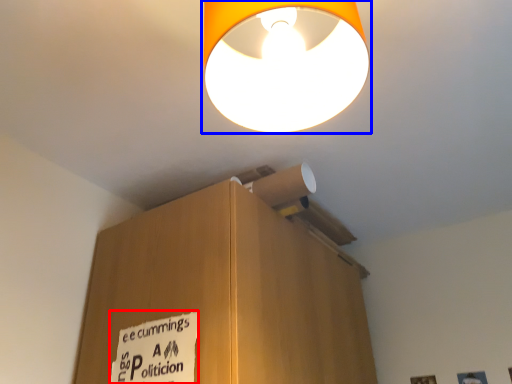
Question: Which object appears farthest to the camera in this image, warning sign (highlighted by a red box) or lamp (highlighted by a blue box)?

Choices:
 (A) warning sign
 (B) lamp

Answer: (A)